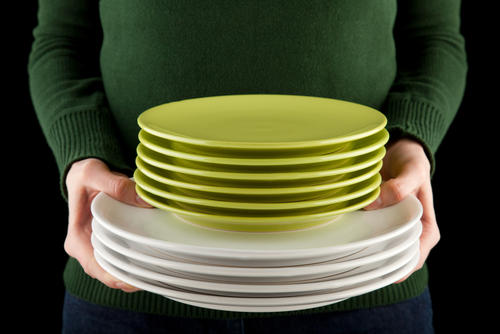
Where is `plates`? The image size is (500, 334). plates is located at coordinates (251, 147), (255, 160), (257, 176), (261, 192), (262, 204), (263, 216), (282, 259), (278, 272), (279, 288), (276, 304).